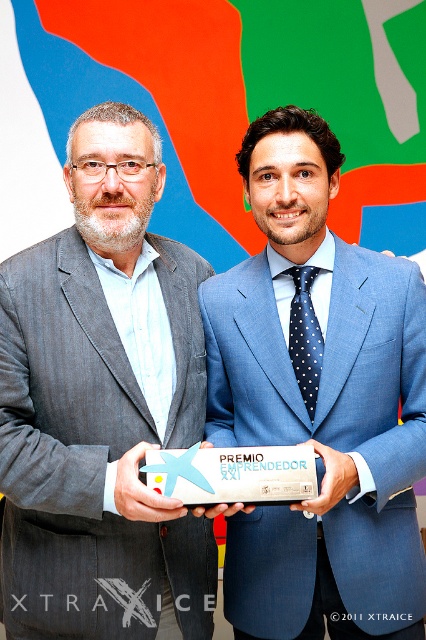
You are a photographer taking a portrait of the two men. You need to ensure the white plastic plaque at center and the dark blue dotted tie at center are clearly visible in the frame. Based on their positions, which one should you focus on first to ensure both are in focus?

The white plastic plaque at center is to the left of the dark blue dotted tie at center, so focusing on the white plastic plaque at center first will help ensure both are in focus since it is closer to the camera.

From the picture: You are an event organizer who needs to adjust the lighting for a photo shoot. You want to ensure that the white plastic plaque at center and the dark blue dotted tie at center are both clearly visible. Which object should you focus the light on first to ensure it doesn

The dark blue dotted tie at center should be focused on first because it is taller than the white plastic plaque at center, so it requires more light to capture its full height in the photo.

You are a photographer standing at the center of the room. You need to position yourself so that the blue woolen suit at center is in the exact center of your camera frame. What adjustment should you make to your current position?

The blue woolen suit at center is already at the center of the frame since its 2D location is at point (336,412), which is the center point of the image coordinate system.